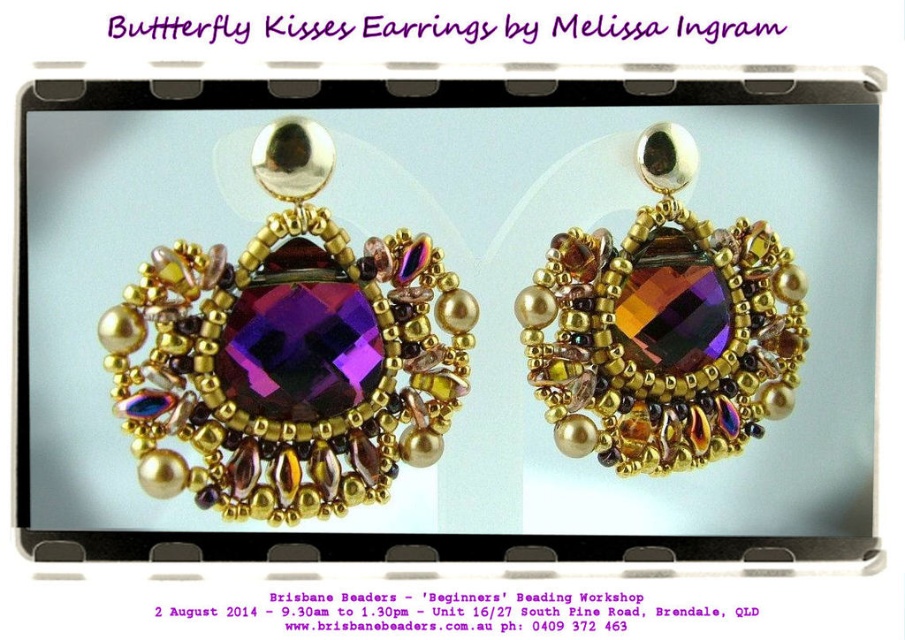
Where is `purple faceted gemstone at center`? The height and width of the screenshot is (640, 905). purple faceted gemstone at center is located at coordinates (289, 355).